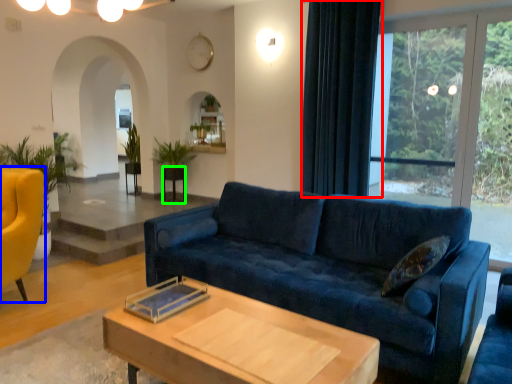
Question: Which is farther away from curtain (highlighted by a red box)? chair (highlighted by a blue box) or side table (highlighted by a green box)?

Choices:
 (A) chair
 (B) side table

Answer: (A)